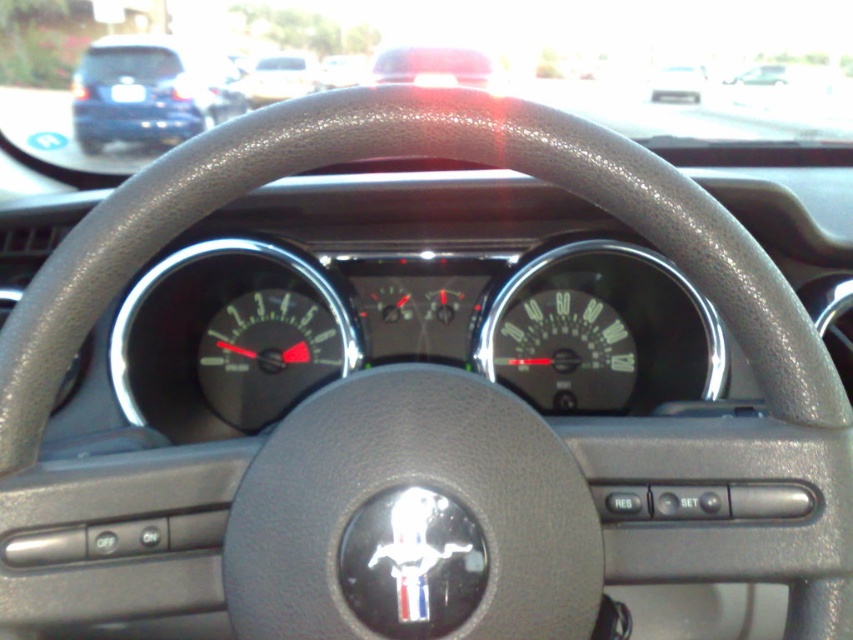
Which is more to the right, black plastic speedometer at center or metallic silver car at upper center?

Positioned to the right is metallic silver car at upper center.

Who is taller, black plastic speedometer at center or metallic silver car at upper center?

black plastic speedometer at center is taller.

Image resolution: width=853 pixels, height=640 pixels. I want to click on black plastic speedometer at center, so click(x=265, y=355).

Is black plastic speedometer at center bigger than matte black car at upper left?

No.

Which of these two, black plastic speedometer at center or matte black car at upper left, stands shorter?

black plastic speedometer at center is shorter.

Between point (247, 340) and point (79, 147), which one is positioned behind?

The point (79, 147) is behind.

The image size is (853, 640). I want to click on black plastic speedometer at center, so click(x=265, y=355).

Is black leather steering wheel at center taller than metallic silver car at upper center?

Yes, black leather steering wheel at center is taller than metallic silver car at upper center.

Does black leather steering wheel at center lie in front of metallic silver car at upper center?

Yes, it is.

The height and width of the screenshot is (640, 853). What are the coordinates of `black leather steering wheel at center` in the screenshot? It's located at (413, 477).